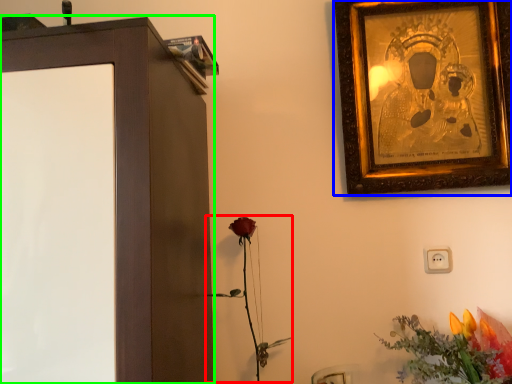
Question: Based on their relative distances, which object is nearer to plant (highlighted by a red box)? Choose from picture frame (highlighted by a blue box) and furniture (highlighted by a green box).

Choices:
 (A) picture frame
 (B) furniture

Answer: (B)